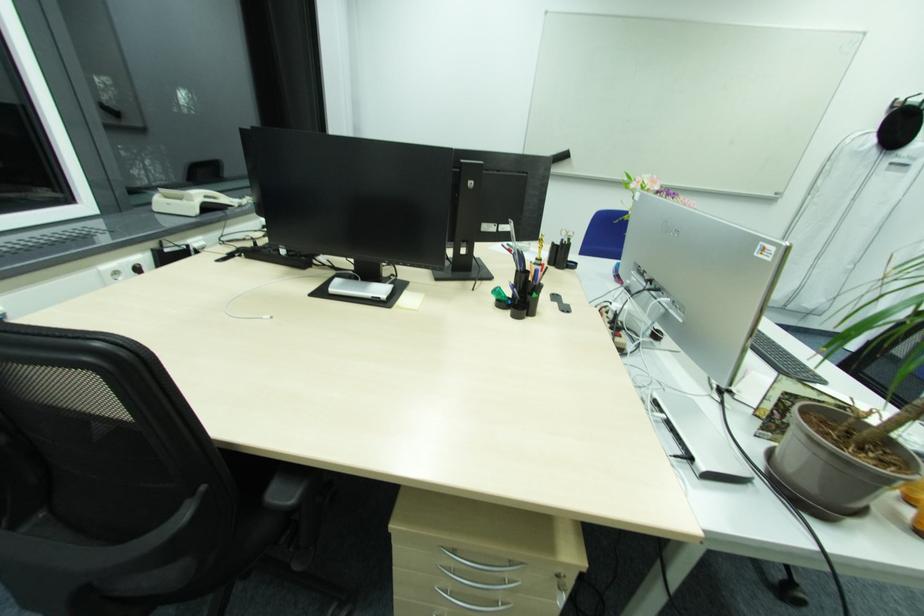
Locate an element on the screen. The image size is (924, 616). blue pen is located at coordinates (513, 293).